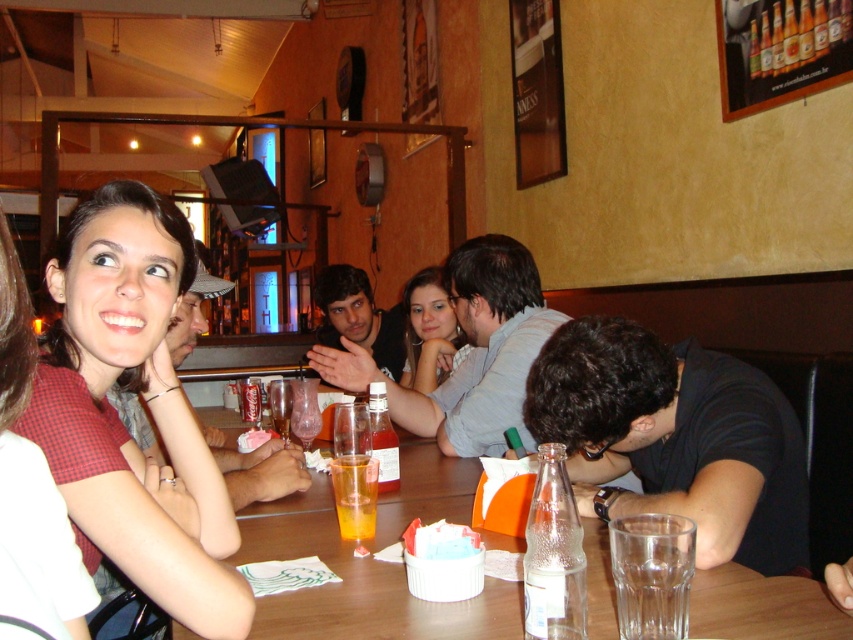
Which is more to the left, matte black shirt at center or translucent glass at table center?

matte black shirt at center is more to the left.

Is matte black shirt at center taller than translucent glass at table center?

Yes, matte black shirt at center is taller than translucent glass at table center.

In order to click on matte black shirt at center in this screenshot , I will do `click(358, 317)`.

Locate an element on the screen. matte black shirt at center is located at coordinates (358, 317).

Can you confirm if red checkered shirt at upper left is positioned to the right of clear glass bottle at lower center?

No, red checkered shirt at upper left is not to the right of clear glass bottle at lower center.

Locate an element on the screen. red checkered shirt at upper left is located at coordinates (30, 492).

Between point (18, 348) and point (569, 609), which one is positioned behind?

Positioned behind is point (569, 609).

Locate an element on the screen. red checkered shirt at upper left is located at coordinates (30, 492).

Can you confirm if matte red shirt at center is wider than clear glass bottle at lower center?

Yes.

Is point (86, 531) positioned after point (572, 557)?

Yes, point (86, 531) is farther from viewer.

Does point (126, 232) come closer to viewer compared to point (584, 630)?

No.

Locate an element on the screen. This screenshot has height=640, width=853. matte red shirt at center is located at coordinates (148, 406).